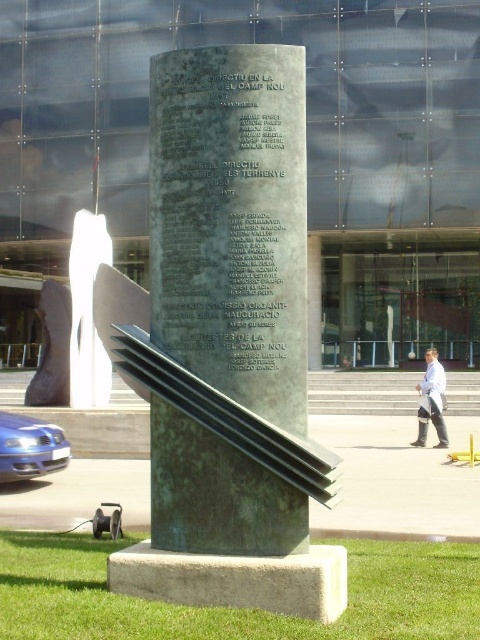
You are a tour guide explaining the monuments in this public space. You need to mention both the green patina stone monument at center and the matte bronze statue at center. Which one is bigger?

The matte bronze statue at center is bigger than the green patina stone monument at center.

You are standing in front of the monument and want to take a photo that includes both the green patina stone monument at center and the modern sculpture in front of it. The camera you are using has a maximum focus range of 25 feet. Can you capture both objects in focus without moving your position?

The green patina stone monument at center is 23.30 feet from the viewer, which is within the camera maximum focus range of 25 feet. The modern sculpture in front of it is closer than the monument, so it will also be within the focus range. Therefore, both objects can be captured in focus without moving your position.

From the picture: You are standing in front of the monument and want to know how far the point at coordinates (x=171, y=308) is from you. Can you determine the distance based on the information provided?

The point at coordinates (x=171, y=308) is 7.39 meters away from the viewer.